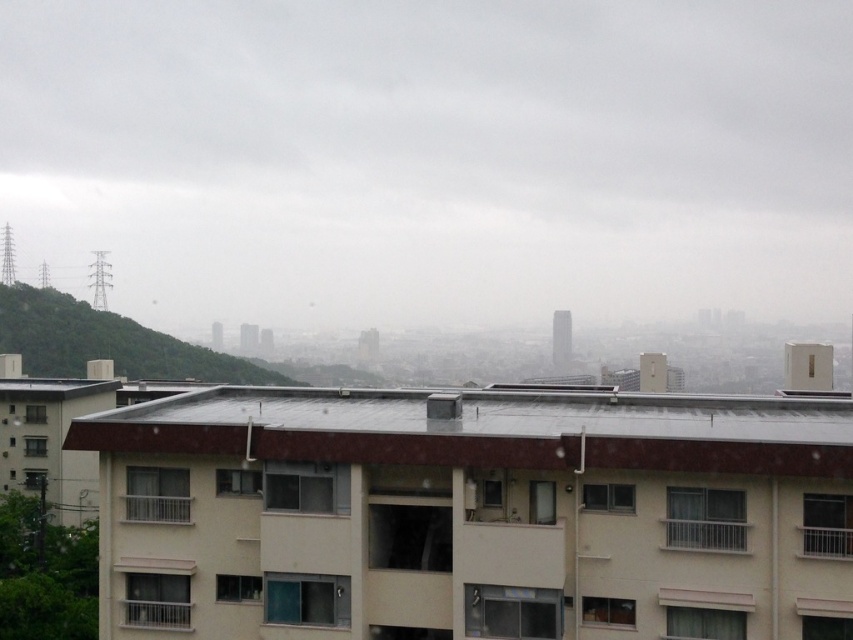
Question: Can you confirm if smooth gray roof at center is positioned to the right of green leafy hillside at left?

Choices:
 (A) yes
 (B) no

Answer: (A)

Question: Does smooth gray roof at center appear on the right side of green leafy hillside at left?

Choices:
 (A) yes
 (B) no

Answer: (A)

Question: Which point is farther from the camera taking this photo?

Choices:
 (A) (32, 291)
 (B) (209, 438)

Answer: (A)

Question: Does smooth gray roof at center appear under green leafy hillside at left?

Choices:
 (A) yes
 (B) no

Answer: (B)